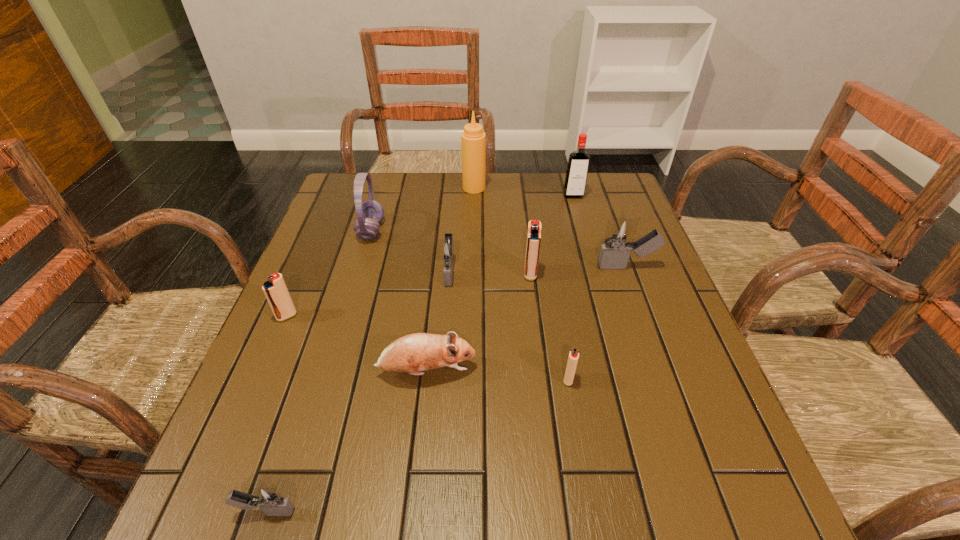
The image size is (960, 540). Find the location of `the seventh farthest object`. the seventh farthest object is located at coordinates (275, 290).

Locate an element on the screen. the leftmost red igniter is located at coordinates (275, 290).

Find the location of a particular element. Image resolution: width=960 pixels, height=540 pixels. hamster is located at coordinates click(x=413, y=353).

Locate an element on the screen. The width and height of the screenshot is (960, 540). the eighth object from left to right is located at coordinates (573, 357).

What are the coordinates of `the nearest red igniter` in the screenshot? It's located at (573, 357).

Where is `the nearest gray igniter`? This screenshot has height=540, width=960. the nearest gray igniter is located at coordinates (269, 500).

The width and height of the screenshot is (960, 540). Identify the location of the nearest object. (269, 500).

Where is `free spot located on the front of the condiment`? The height and width of the screenshot is (540, 960). free spot located on the front of the condiment is located at coordinates (473, 234).

I want to click on vacant area situated 0.370m on the front and back of the red vodka, so click(598, 285).

At what (x,y) coordinates should I click in order to perform the action: click on vacant region located 0.360m on the headband and ear cups of the headset. Please return your answer as a coordinate pair (x, y). The height and width of the screenshot is (540, 960). Looking at the image, I should click on (515, 230).